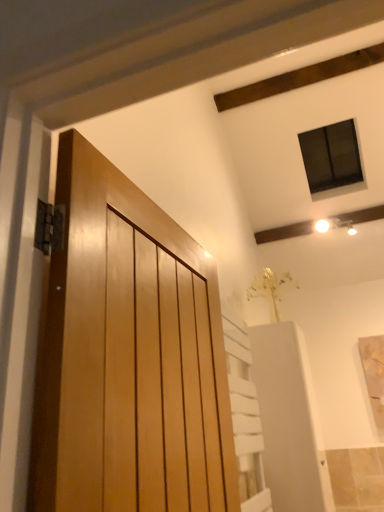
The image size is (384, 512). What do you see at coordinates (129, 357) in the screenshot? I see `glossy wood door at left` at bounding box center [129, 357].

This screenshot has width=384, height=512. In order to click on glossy wood door at left in this screenshot , I will do `click(129, 357)`.

Image resolution: width=384 pixels, height=512 pixels. What are the coordinates of `white matte elevator at lower right` in the screenshot? It's located at (289, 420).

What is the approximate height of white matte elevator at lower right?

It is 38.85 inches.

What do you see at coordinates (289, 420) in the screenshot? I see `white matte elevator at lower right` at bounding box center [289, 420].

Where is `glossy wood door at left`? The width and height of the screenshot is (384, 512). glossy wood door at left is located at coordinates (129, 357).

Which object is positioned more to the right, white matte elevator at lower right or glossy wood door at left?

Positioned to the right is white matte elevator at lower right.

Which object is closer to the camera taking this photo, white matte elevator at lower right or glossy wood door at left?

glossy wood door at left is more forward.

Is point (283, 323) closer to camera compared to point (230, 422)?

No, it is not.

From the image's perspective, between white matte elevator at lower right and glossy wood door at left, which one is located above?

From the image's view, glossy wood door at left is above.

From a real-world perspective, is white matte elevator at lower right under glossy wood door at left?

Yes, from a real-world perspective, white matte elevator at lower right is under glossy wood door at left.

Which of these two, white matte elevator at lower right or glossy wood door at left, is thinner?

glossy wood door at left.

Considering the relative sizes of white matte elevator at lower right and glossy wood door at left in the image provided, is white matte elevator at lower right taller than glossy wood door at left?

Yes.

Which of these two, white matte elevator at lower right or glossy wood door at left, is smaller?

glossy wood door at left is smaller.

Would you say white matte elevator at lower right is inside or outside glossy wood door at left?

white matte elevator at lower right cannot be found inside glossy wood door at left.

Is white matte elevator at lower right in contact with glossy wood door at left?

There is a gap between white matte elevator at lower right and glossy wood door at left.

Is glossy wood door at left at the back of white matte elevator at lower right?

No, white matte elevator at lower right is not facing the opposite direction of glossy wood door at left.

Measure the distance between white matte elevator at lower right and glossy wood door at left.

white matte elevator at lower right is 4.02 feet away from glossy wood door at left.

This screenshot has width=384, height=512. Find the location of `elevator on the right of glossy wood door at left`. elevator on the right of glossy wood door at left is located at coordinates (289, 420).

Can you confirm if glossy wood door at left is positioned to the left of white matte elevator at lower right?

Correct, you'll find glossy wood door at left to the left of white matte elevator at lower right.

Is the depth of glossy wood door at left less than that of white matte elevator at lower right?

Yes, it is.

Is point (94, 368) positioned in front of point (264, 382)?

Yes, point (94, 368) is in front of point (264, 382).

From the image's perspective, who appears lower, glossy wood door at left or white matte elevator at lower right?

white matte elevator at lower right is shown below in the image.

From a real-world perspective, relative to white matte elevator at lower right, is glossy wood door at left vertically above or below?

From a real-world perspective, glossy wood door at left is physically above white matte elevator at lower right.

Between glossy wood door at left and white matte elevator at lower right, which one has smaller width?

With smaller width is glossy wood door at left.

Which of these two, glossy wood door at left or white matte elevator at lower right, stands shorter?

glossy wood door at left is shorter.

Who is smaller, glossy wood door at left or white matte elevator at lower right?

With smaller size is glossy wood door at left.

Can we say glossy wood door at left lies outside white matte elevator at lower right?

glossy wood door at left is positioned outside white matte elevator at lower right.

Is glossy wood door at left directly adjacent to white matte elevator at lower right?

No, glossy wood door at left is not making contact with white matte elevator at lower right.

Is glossy wood door at left facing away from white matte elevator at lower right?

That's not correct — glossy wood door at left is not looking away from white matte elevator at lower right.

Can you tell me how much glossy wood door at left and white matte elevator at lower right differ in facing direction?

2.92 degrees separate the facing orientations of glossy wood door at left and white matte elevator at lower right.

Identify the location of door on the left of white matte elevator at lower right. This screenshot has width=384, height=512. (129, 357).

Find the location of a particular element. Image resolution: width=384 pixels, height=512 pixels. elevator lying behind the glossy wood door at left is located at coordinates (289, 420).

I want to click on door on the left of white matte elevator at lower right, so click(x=129, y=357).